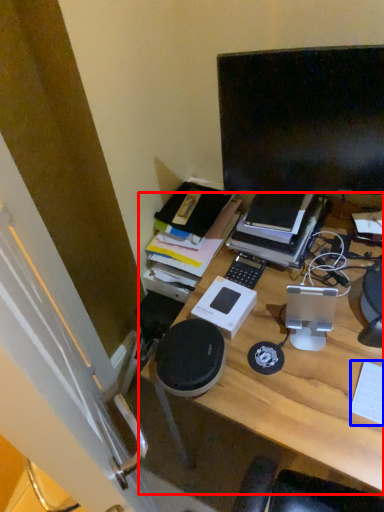
Question: Which of the following is the closest to the observer, desk (highlighted by a red box) or computer keyboard (highlighted by a blue box)?

Choices:
 (A) desk
 (B) computer keyboard

Answer: (A)